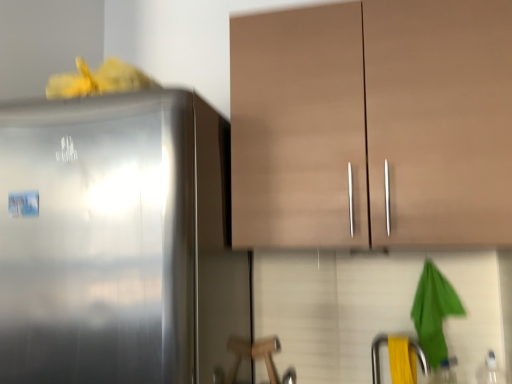
Question: Is matte brown cabinet at upper center next to satin silver refrigerator at left and touching it?

Choices:
 (A) no
 (B) yes

Answer: (A)

Question: Does matte brown cabinet at upper center have a greater height compared to satin silver refrigerator at left?

Choices:
 (A) yes
 (B) no

Answer: (B)

Question: Does matte brown cabinet at upper center have a smaller size compared to satin silver refrigerator at left?

Choices:
 (A) yes
 (B) no

Answer: (A)

Question: From a real-world perspective, is matte brown cabinet at upper center over satin silver refrigerator at left?

Choices:
 (A) yes
 (B) no

Answer: (A)

Question: Does matte brown cabinet at upper center come in front of satin silver refrigerator at left?

Choices:
 (A) no
 (B) yes

Answer: (A)

Question: From the image's perspective, is matte brown cabinet at upper center on top of satin silver refrigerator at left?

Choices:
 (A) yes
 (B) no

Answer: (A)

Question: From a real-world perspective, is yellow rubber at lower right positioned over satin silver refrigerator at left based on gravity?

Choices:
 (A) yes
 (B) no

Answer: (B)

Question: Is yellow rubber at lower right located outside satin silver refrigerator at left?

Choices:
 (A) no
 (B) yes

Answer: (B)

Question: Can you confirm if yellow rubber at lower right is bigger than satin silver refrigerator at left?

Choices:
 (A) yes
 (B) no

Answer: (B)

Question: Considering the relative sizes of yellow rubber at lower right and satin silver refrigerator at left in the image provided, is yellow rubber at lower right thinner than satin silver refrigerator at left?

Choices:
 (A) yes
 (B) no

Answer: (A)

Question: From the image's perspective, is yellow rubber at lower right beneath satin silver refrigerator at left?

Choices:
 (A) no
 (B) yes

Answer: (B)

Question: Considering the relative sizes of yellow rubber at lower right and satin silver refrigerator at left in the image provided, is yellow rubber at lower right wider than satin silver refrigerator at left?

Choices:
 (A) yes
 (B) no

Answer: (B)

Question: From the image's perspective, would you say matte brown cabinet at upper center is positioned over yellow rubber at lower right?

Choices:
 (A) no
 (B) yes

Answer: (B)